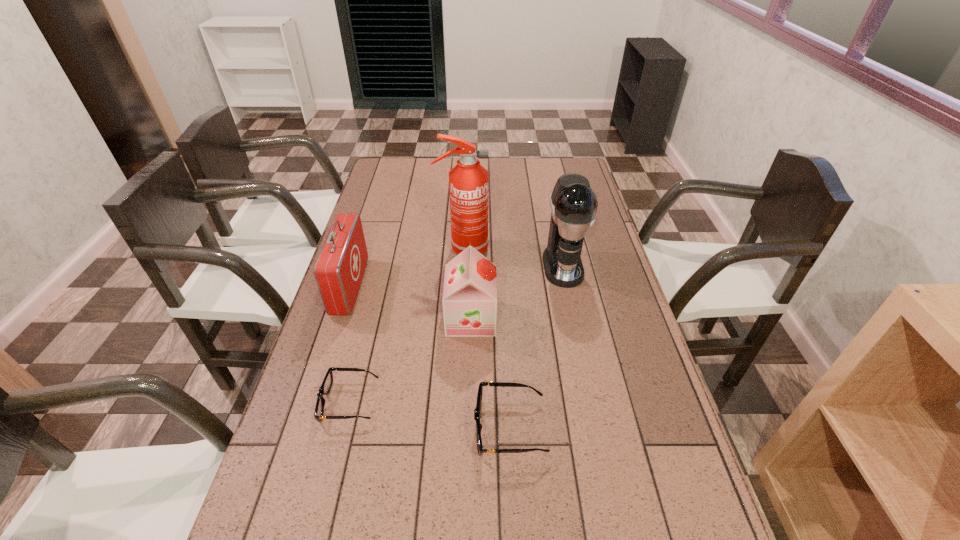
Please point a free position for a sunglasses on the right. Please provide its 2D coordinates. Your answer should be formatted as a tuple, i.e. [(x, y)], where the tuple contains the x and y coordinates of a point satisfying the conditions above.

[(687, 456)]